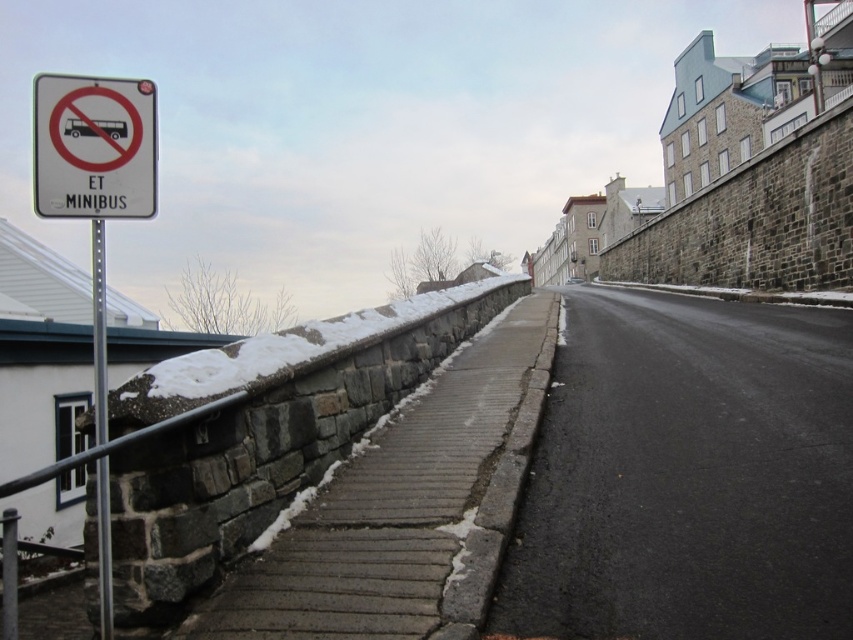
Question: Can you confirm if white plastic sign at upper left is positioned below metallic pole at left?

Choices:
 (A) yes
 (B) no

Answer: (B)

Question: Is white plastic sign at upper left below metallic pole at left?

Choices:
 (A) no
 (B) yes

Answer: (A)

Question: Among these points, which one is nearest to the camera?

Choices:
 (A) (126, 77)
 (B) (97, 365)

Answer: (B)

Question: Among these objects, which one is farthest from the camera?

Choices:
 (A) metallic pole at left
 (B) white plastic sign at upper left

Answer: (B)

Question: Considering the relative positions of white plastic sign at upper left and metallic pole at left in the image provided, where is white plastic sign at upper left located with respect to metallic pole at left?

Choices:
 (A) right
 (B) left

Answer: (B)

Question: Which of the following is the closest to the observer?

Choices:
 (A) (105, 358)
 (B) (125, 192)

Answer: (A)